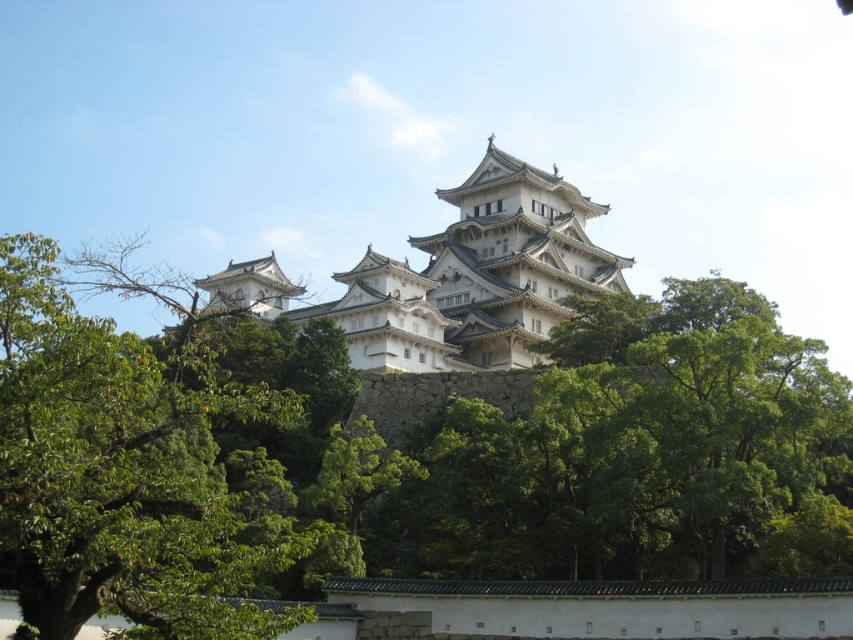
Consider the image. You are a gardener planning to plant a new tree in the area between the green leafy tree at center and the green leafy tree at left. Based on their widths, which tree would you consider for pruning to ensure enough space for the new tree?

The green leafy tree at center might be wider than the green leafy tree at left, so pruning the wider tree could provide more space for the new tree.

You are standing at the base of the hill looking up at the castle. You notice two green leafy trees in the scene. Which tree, the green leafy tree at center or the green leafy tree at left, is positioned more to your right side?

The green leafy tree at center is positioned more to the right side compared to the green leafy tree at left.

You are standing at the base of the castle hill and want to reach the highest point of the castle. You notice two points marked on the image. Which point, point [172,522] or point [560,280], is closer to you?

Point [172,522] is closer to the viewer than point [560,280], so you should head towards point [172,522] first.